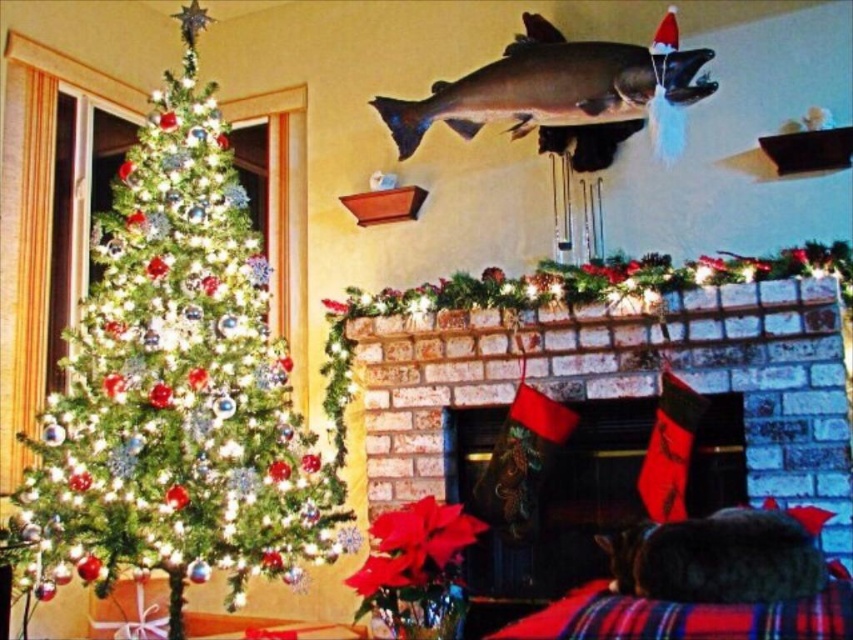
You are a delivery robot that is 30 inches wide. You need to move from the entrance to the living room to the brick fireplace at center. There is a green matte christmas tree at left in your path. Can you pass between them without hitting either?

The distance between the green matte christmas tree at left and the brick fireplace at center is 32.84 inches. Since the robot is 30 inches wide, it can pass through the space between them without any issues.

From the picture: You are standing in the room and want to place a small gift under the Christmas tree. The coordinates of the tree are given as point (177, 385). Can you confirm if this point is located on the green matte Christmas tree at left?

Yes, the point (177, 385) is on the green matte Christmas tree at left according to the provided coordinates.